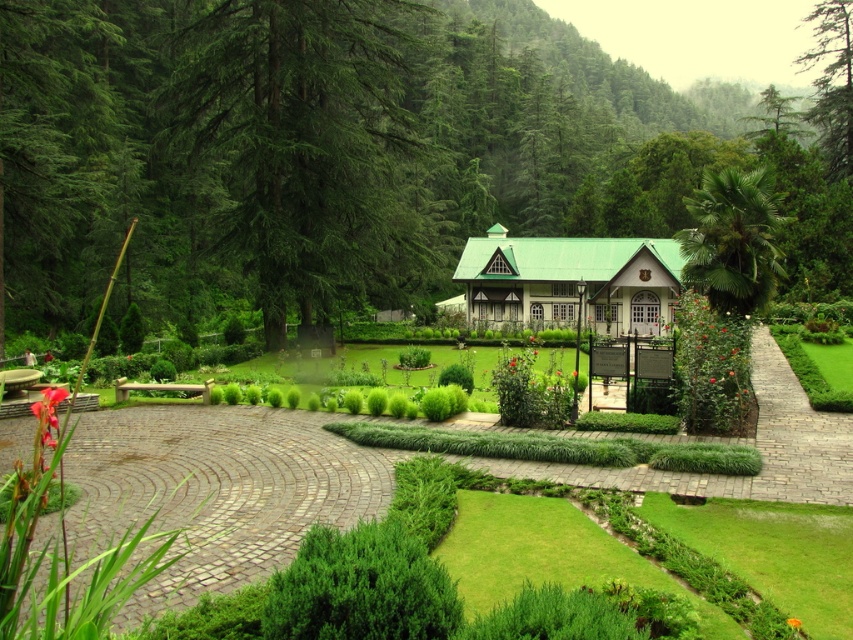
Who is positioned more to the right, orange fabric flower at center or red matte rose at center?

From the viewer's perspective, red matte rose at center appears more on the right side.

Between point (793, 620) and point (529, 340), which one is positioned behind?

Point (529, 340)

Which is behind, point (793, 621) or point (529, 337)?

Positioned behind is point (529, 337).

The width and height of the screenshot is (853, 640). I want to click on orange fabric flower at center, so click(x=793, y=621).

Who is positioned more to the left, green wooden cottage at center or red matte rose at center?

From the viewer's perspective, red matte rose at center appears more on the left side.

Can you confirm if green wooden cottage at center is smaller than red matte rose at center?

Incorrect, green wooden cottage at center is not smaller in size than red matte rose at center.

The height and width of the screenshot is (640, 853). Find the location of `green wooden cottage at center`. green wooden cottage at center is located at coordinates (569, 282).

I want to click on green wooden cottage at center, so click(569, 282).

Who is shorter, green textured tree at upper left or red matte rose at center?

Standing shorter between the two is red matte rose at center.

Is point (247, 211) positioned before point (532, 337)?

Yes, it is.

You are a GUI agent. You are given a task and a screenshot of the screen. Output one action in this format:
    pyautogui.click(x=<x>, y=<y>)
    Task: Click on the green textured tree at upper left
    
    Given the screenshot: What is the action you would take?
    pyautogui.click(x=312, y=150)